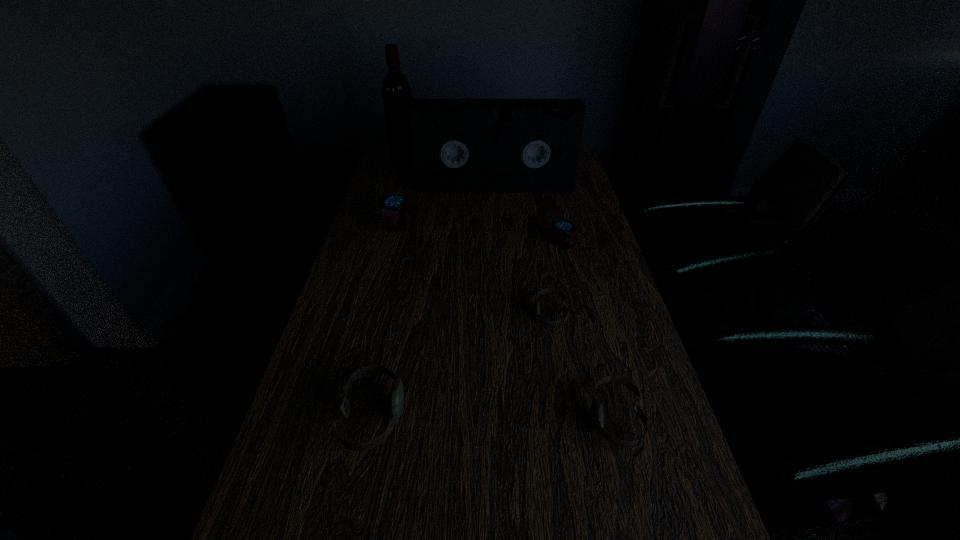
Where is `the second shortest object`? the second shortest object is located at coordinates [x=596, y=406].

Locate an element on the screen. The image size is (960, 540). the second beige watch from right to left is located at coordinates (536, 305).

The height and width of the screenshot is (540, 960). I want to click on the shortest watch, so click(536, 305).

Identify the location of blank area located on the label of the farthest object. The width and height of the screenshot is (960, 540). (486, 154).

Identify the location of vacant space positioned 0.280m on the side of the sixth nearest object with visible spindles. (497, 239).

Locate an element on the screen. This screenshot has width=960, height=540. free point located on the front of the farther red watch is located at coordinates (386, 266).

At what (x,y) coordinates should I click in order to perform the action: click on vacant region located on the face of the biggest beige watch. Please return your answer as a coordinate pair (x, y). The image size is (960, 540). Looking at the image, I should click on (558, 415).

Locate an element on the screen. free point located on the left of the fourth nearest watch is located at coordinates (439, 245).

Identify the location of vacant space located 0.360m on the face of the fourth tallest watch. This screenshot has width=960, height=540. (415, 418).

Identify the location of free space located 0.060m on the face of the fourth tallest watch. Image resolution: width=960 pixels, height=540 pixels. (562, 418).